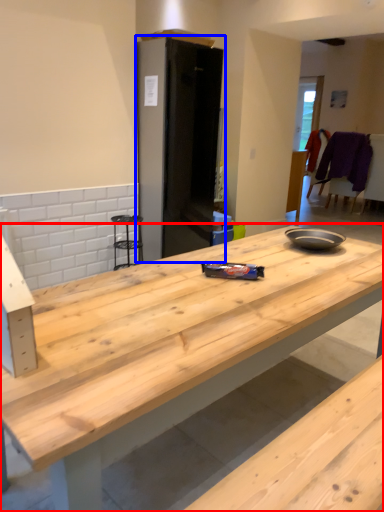
Question: Which point is closer to the camera, countertop (highlighted by a red box) or appliance (highlighted by a blue box)?

Choices:
 (A) countertop
 (B) appliance

Answer: (A)